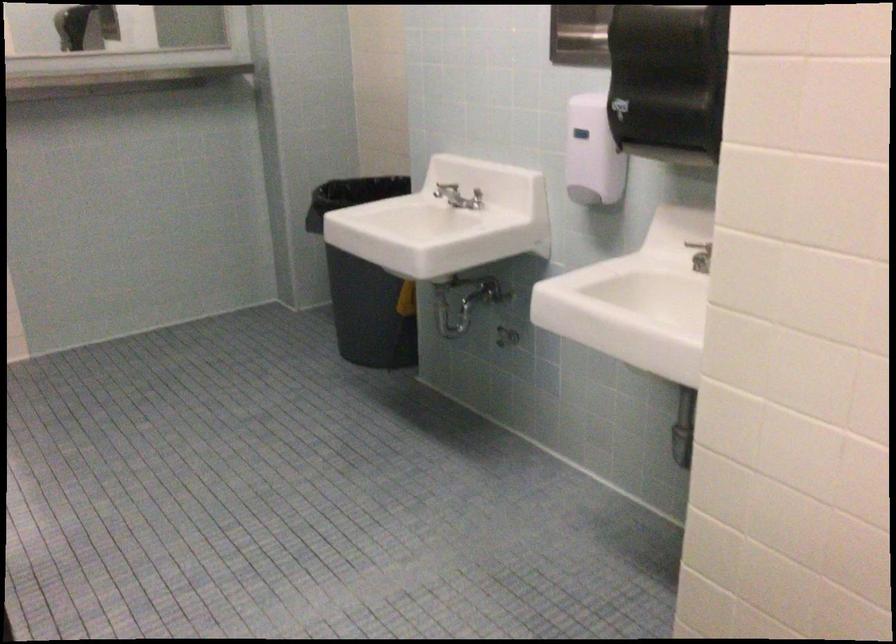
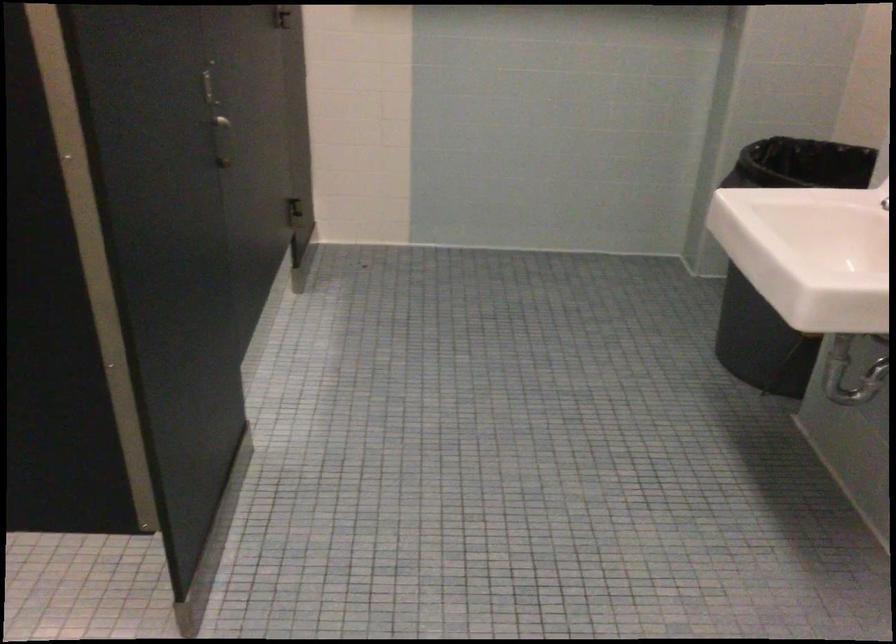
Question: How did the camera likely rotate?

Choices:
 (A) Left
 (B) Right
 (C) Up
 (D) Down

Answer: (A)